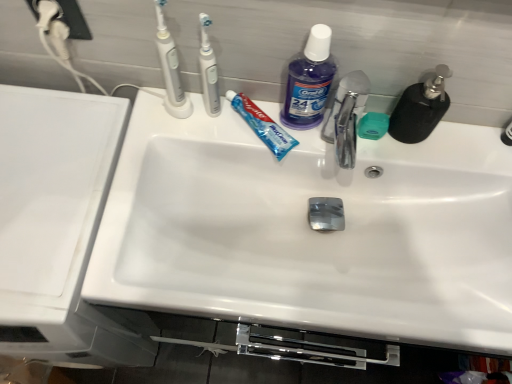
Where is `blank area to the left of white plastic toothbrush at upper center, which ranks as the 2th toothbrush in left-to-right order`? The height and width of the screenshot is (384, 512). blank area to the left of white plastic toothbrush at upper center, which ranks as the 2th toothbrush in left-to-right order is located at coordinates (155, 126).